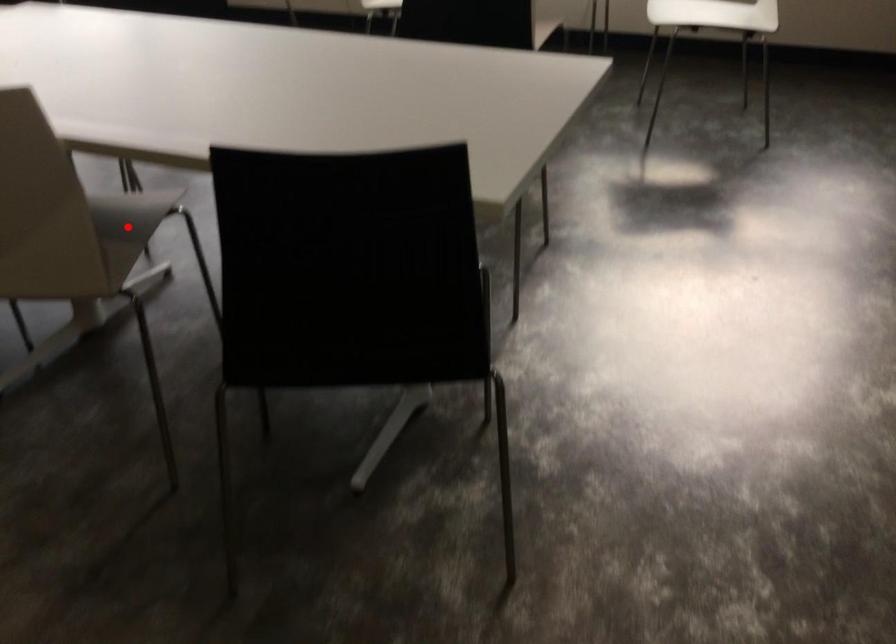
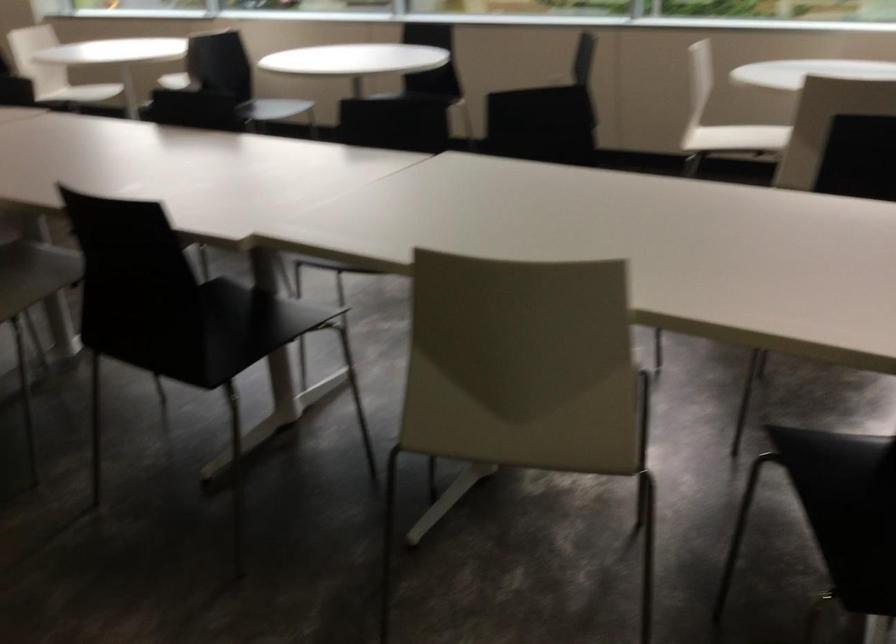
Question: I am providing you with two images of the same scene from different viewpoints. A red point is marked on the first image. At the location where the point appears in image 1, is it still visible in image 2?

Choices:
 (A) Yes
 (B) No

Answer: (B)